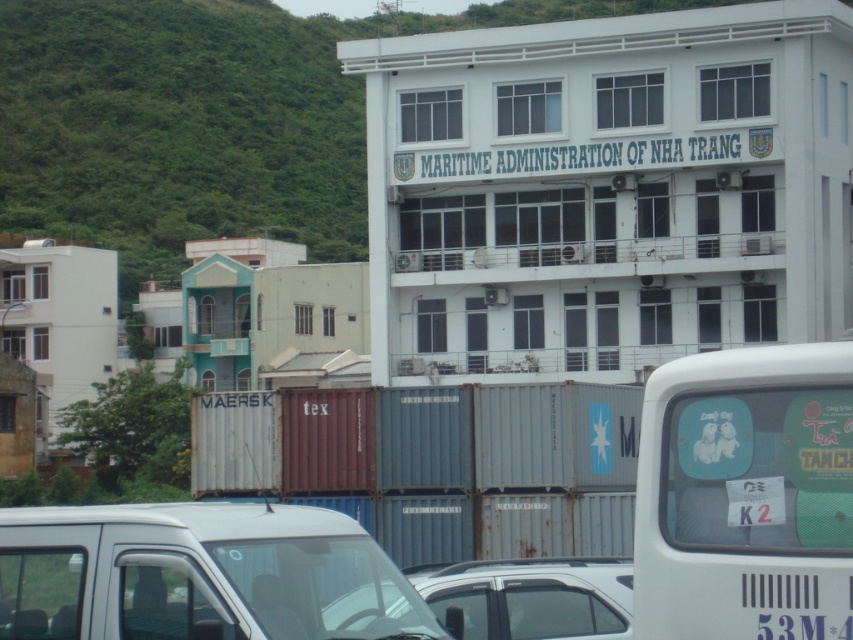
Is point (799, 602) closer to viewer compared to point (10, 592)?

Yes, point (799, 602) is closer to viewer.

Image resolution: width=853 pixels, height=640 pixels. What do you see at coordinates (746, 496) in the screenshot?
I see `white matte van at right` at bounding box center [746, 496].

Who is more distant from viewer, [648,410] or [291,529]?

Point [291,529]

You are a GUI agent. You are given a task and a screenshot of the screen. Output one action in this format:
    pyautogui.click(x=<x>, y=<y>)
    Task: Click on the white matte van at right
    
    Given the screenshot: What is the action you would take?
    pyautogui.click(x=746, y=496)

Between point (683, 506) and point (495, 576), which one is positioned behind?

Positioned behind is point (495, 576).

Is white matte van at right to the left of white matte car at center from the viewer's perspective?

No, white matte van at right is not to the left of white matte car at center.

Identify the location of white matte van at right. (746, 496).

Does white matte van at lower left lie in front of white matte car at center?

Yes.

Where is `white matte van at lower left`? This screenshot has height=640, width=853. white matte van at lower left is located at coordinates (200, 573).

Locate an element on the screen. white matte van at lower left is located at coordinates (200, 573).